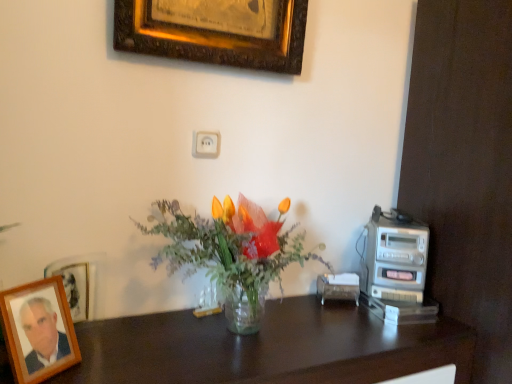
Where is `free point above dark wood desk at center (from a real-world perspective)`? The height and width of the screenshot is (384, 512). free point above dark wood desk at center (from a real-world perspective) is located at coordinates (243, 341).